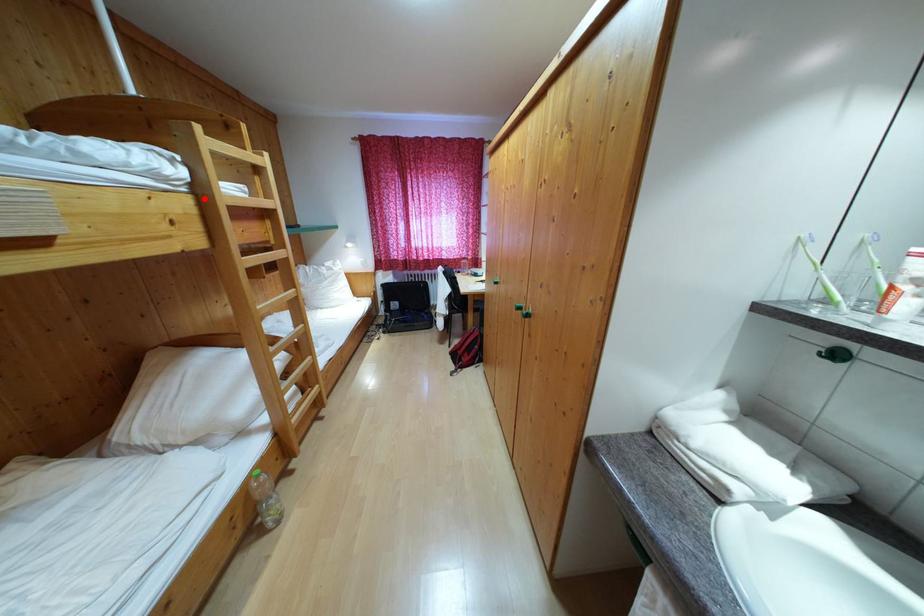
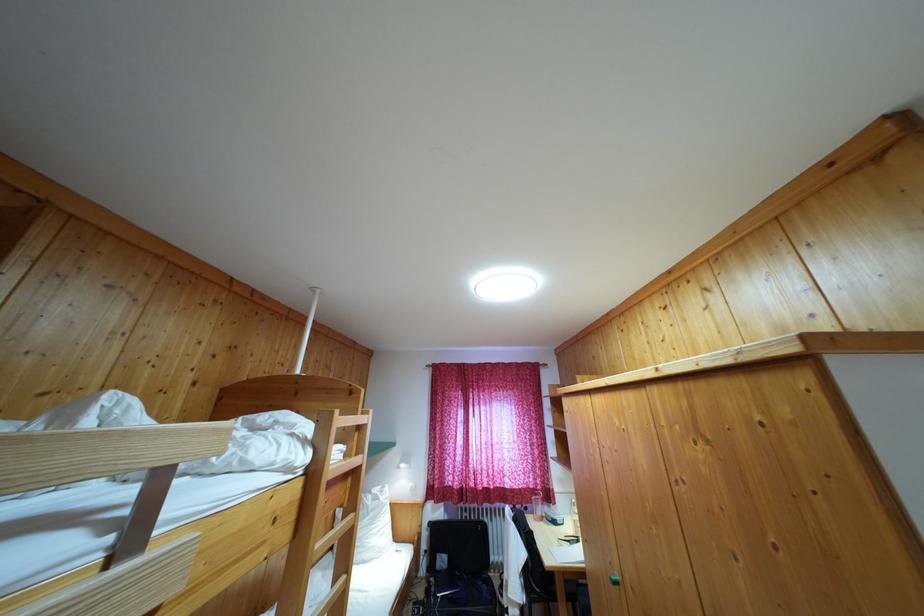
Locate, in the second image, the point that corresponds to the highlighted location in the first image.

(317, 479)